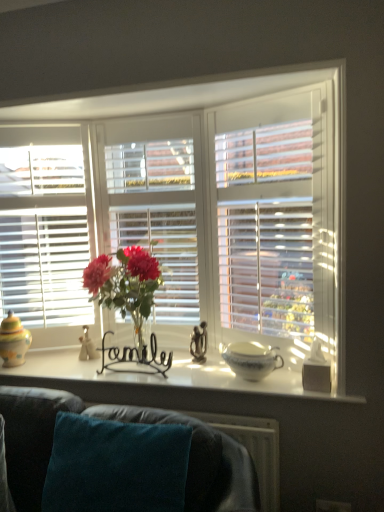
Question: In terms of height, does black wire at center, which is the second candle holder from front to back, look taller or shorter compared to teal fabric couch at lower center?

Choices:
 (A) short
 (B) tall

Answer: (A)

Question: Based on their positions, is black wire at center, marked as the second candle holder in a back-to-front arrangement, located to the left or right of teal fabric couch at lower center?

Choices:
 (A) right
 (B) left

Answer: (A)

Question: Which object is the closest to the black wire at center, which is the second candle holder from front to back?

Choices:
 (A) teal fabric couch at lower center
 (B) white ceramic bowl at center
 (C) white glossy window sill at center
 (D) white matte tissue box at right, the 1th candle holder in the front-to-back sequence
 (E) translucent glass vase at center

Answer: (C)

Question: Estimate the real-world distances between objects in this image. Which object is farther from the white ceramic bowl at center?

Choices:
 (A) translucent glass vase at center
 (B) white wooden blinds at center
 (C) black wire at center, positioned as the second candle holder in right-to-left order
 (D) multicolored ceramic jar at left, which ranks as the third candle holder in right-to-left order
 (E) teal fabric couch at lower center

Answer: (D)